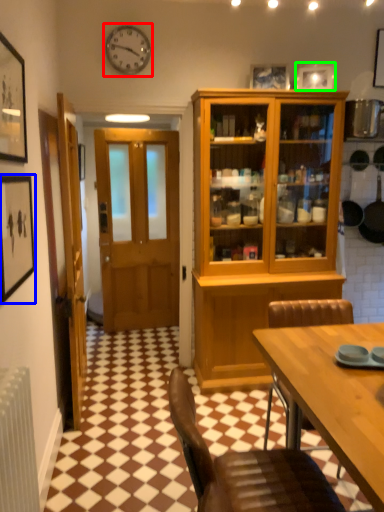
Question: Considering the real-world distances, which object is farthest from clock (highlighted by a red box)? picture frame (highlighted by a blue box) or picture frame (highlighted by a green box)?

Choices:
 (A) picture frame
 (B) picture frame

Answer: (A)